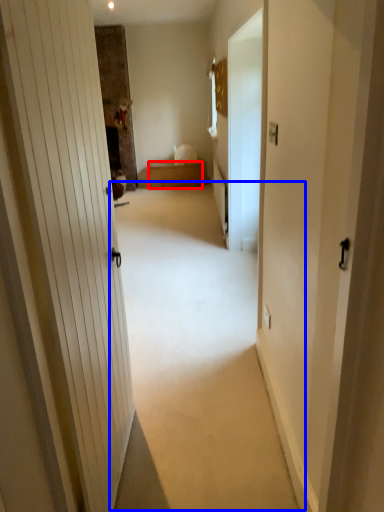
Question: Which point is further to the camera, furniture (highlighted by a red box) or plain (highlighted by a blue box)?

Choices:
 (A) furniture
 (B) plain

Answer: (A)